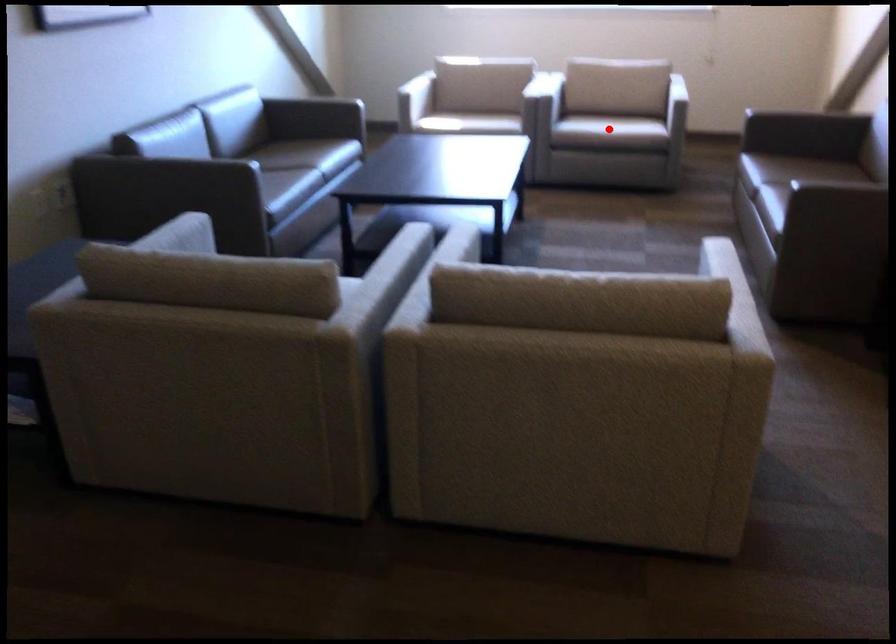
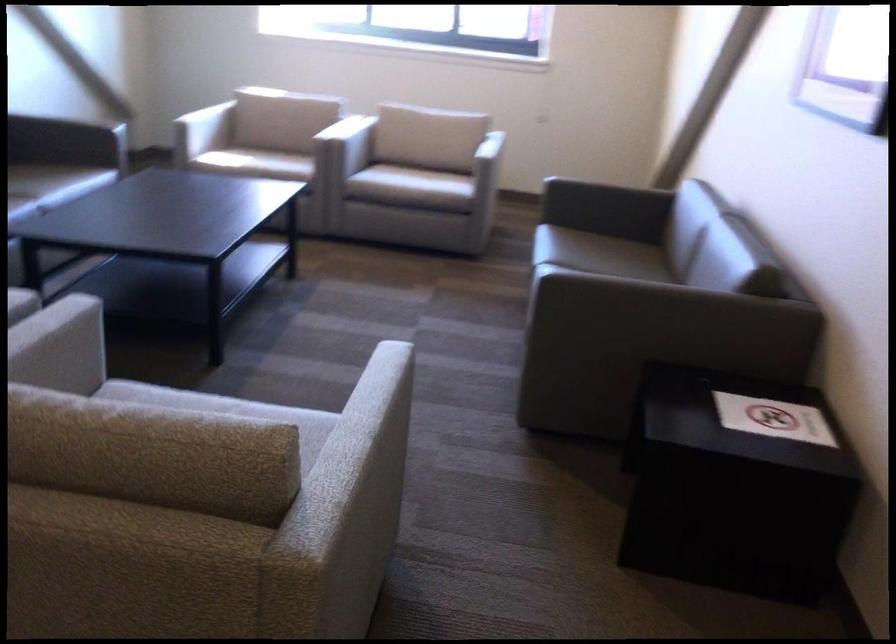
The point at the highlighted location is marked in the first image. Where is the corresponding point in the second image?

(412, 187)